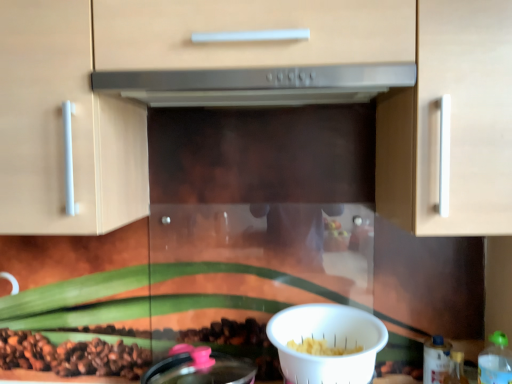
Question: Is satin silver range hood at center facing away from white plastic bowl at lower center?

Choices:
 (A) yes
 (B) no

Answer: (B)

Question: Is satin silver range hood at center oriented towards white plastic bowl at lower center?

Choices:
 (A) yes
 (B) no

Answer: (B)

Question: Does satin silver range hood at center have a greater width compared to white plastic bowl at lower center?

Choices:
 (A) yes
 (B) no

Answer: (A)

Question: Is satin silver range hood at center to the right of white plastic bowl at lower center from the viewer's perspective?

Choices:
 (A) yes
 (B) no

Answer: (B)

Question: From a real-world perspective, does satin silver range hood at center stand above white plastic bowl at lower center?

Choices:
 (A) yes
 (B) no

Answer: (A)

Question: From a real-world perspective, does satin silver range hood at center sit lower than white plastic bowl at lower center?

Choices:
 (A) no
 (B) yes

Answer: (A)

Question: Is matte wood cabinet at center to the right of satin silver range hood at center from the viewer's perspective?

Choices:
 (A) yes
 (B) no

Answer: (B)

Question: Does matte wood cabinet at center lie in front of satin silver range hood at center?

Choices:
 (A) yes
 (B) no

Answer: (A)

Question: Considering the relative sizes of matte wood cabinet at center and satin silver range hood at center in the image provided, is matte wood cabinet at center shorter than satin silver range hood at center?

Choices:
 (A) yes
 (B) no

Answer: (B)

Question: Could you tell me if matte wood cabinet at center is facing satin silver range hood at center?

Choices:
 (A) yes
 (B) no

Answer: (A)

Question: Is matte wood cabinet at center taller than satin silver range hood at center?

Choices:
 (A) yes
 (B) no

Answer: (A)

Question: Would you say matte wood cabinet at center contains satin silver range hood at center?

Choices:
 (A) no
 (B) yes

Answer: (B)

Question: Is green plastic bottle at lower right, which is counted as the 1th bottle, starting from the front, thinner than white plastic bowl at lower center?

Choices:
 (A) no
 (B) yes

Answer: (B)